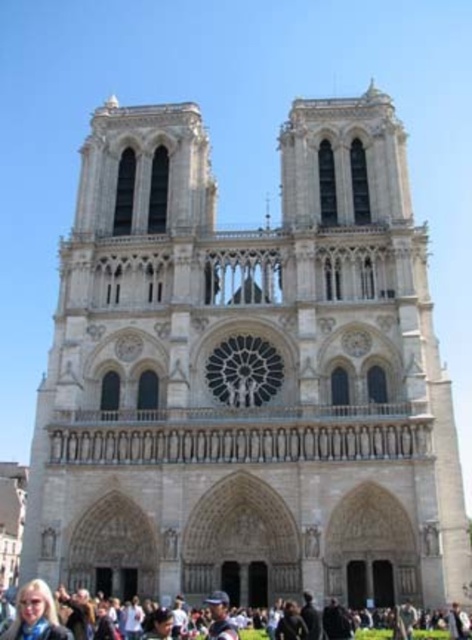
Question: Which point is closer to the camera?

Choices:
 (A) blonde hair at lower left
 (B) dark gray concrete crowd at lower center
 (C) light blue fabric at lower center

Answer: (A)

Question: Which object is positioned farthest from the light blue fabric at lower center?

Choices:
 (A) blonde hair at lower left
 (B) dark gray concrete crowd at lower center

Answer: (A)

Question: Is blonde hair at lower left smaller than light blue fabric at lower center?

Choices:
 (A) yes
 (B) no

Answer: (B)

Question: Can you confirm if blonde hair at lower left is positioned above light blue fabric at lower center?

Choices:
 (A) no
 (B) yes

Answer: (B)

Question: Does dark gray concrete crowd at lower center have a larger size compared to light blue fabric at lower center?

Choices:
 (A) no
 (B) yes

Answer: (B)

Question: Considering the real-world distances, which object is closest to the blonde hair at lower left?

Choices:
 (A) dark gray concrete crowd at lower center
 (B) light blue fabric at lower center

Answer: (A)